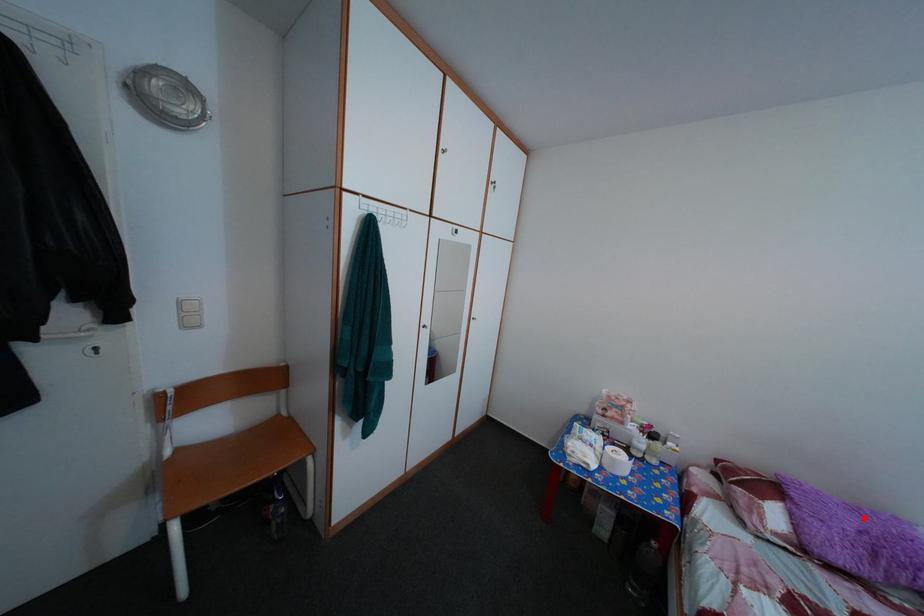
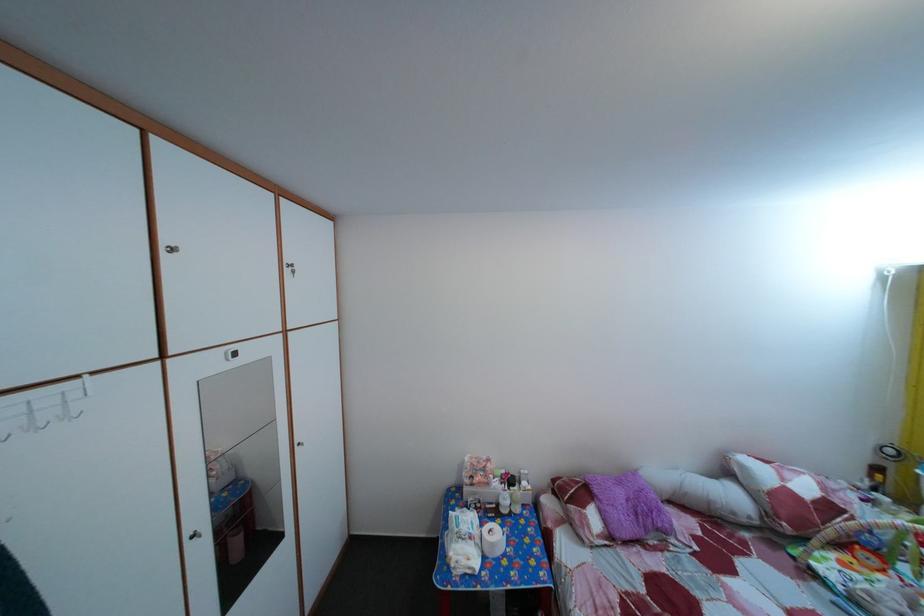
Question: I am providing you with two images of the same scene from different viewpoints. Given a red point in image1, look at the same physical point in image2. Is it:

Choices:
 (A) Closer to the viewpoint
 (B) Farther from the viewpoint

Answer: (B)